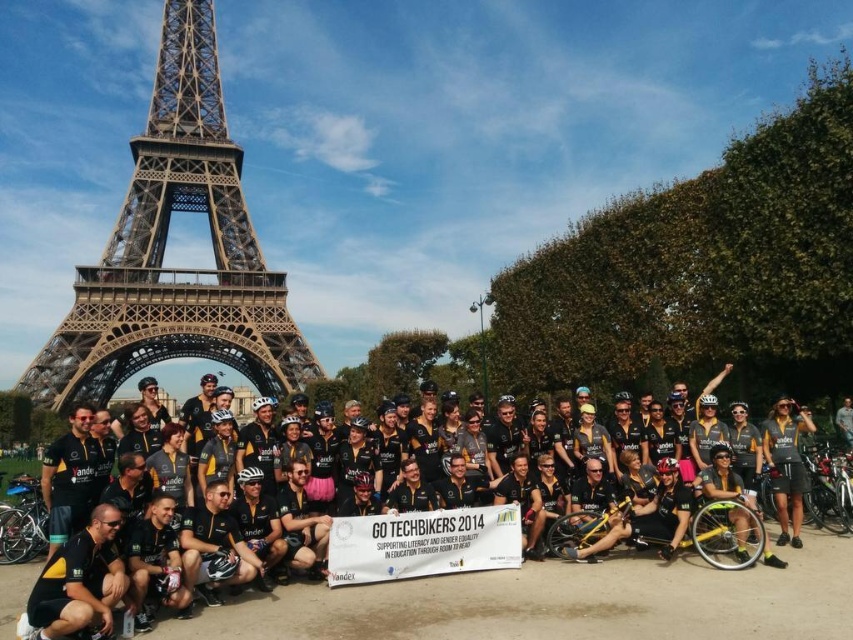
Question: Does metallic brown eiffel tower at center appear over black matte jersey at center?

Choices:
 (A) no
 (B) yes

Answer: (B)

Question: Can you confirm if metallic brown eiffel tower at center is positioned to the left of black matte jersey at center?

Choices:
 (A) yes
 (B) no

Answer: (A)

Question: Which object appears closest to the camera in this image?

Choices:
 (A) metallic brown eiffel tower at center
 (B) black matte jersey at center

Answer: (B)

Question: Can you confirm if metallic brown eiffel tower at center is thinner than black matte jersey at center?

Choices:
 (A) yes
 (B) no

Answer: (A)

Question: Which point is closer to the camera taking this photo?

Choices:
 (A) (80, 369)
 (B) (200, 628)

Answer: (B)